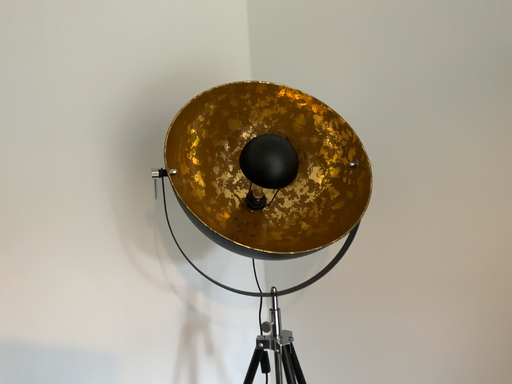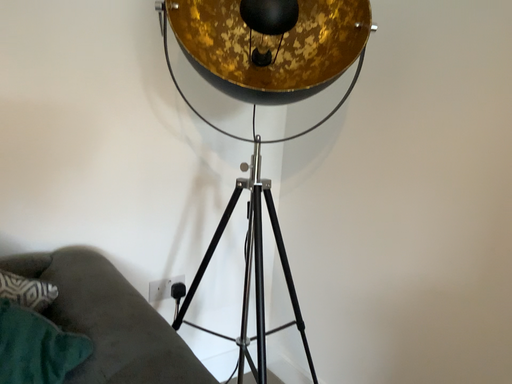
Question: Which way did the camera rotate in the video?

Choices:
 (A) rotated left
 (B) rotated right

Answer: (A)